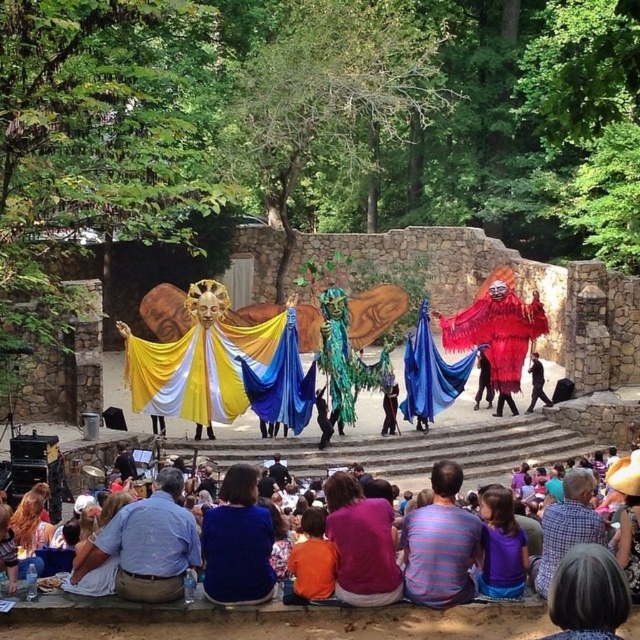
You are an audience member sitting in the front row of the outdoor theatrical performance. You notice two items on the stage. The first is the striped cotton shirt at lower center worn by a performer, and the second is the blue fabric at center. Which item takes up more space on the stage?

The blue fabric at center takes up more space on the stage than the striped cotton shirt at lower center because the striped cotton shirt at lower center occupies less space than blue fabric at center.

You are an audience member sitting at the front row of the outdoor theatrical performance. You notice a striped cotton shirt at lower center. Where exactly is the striped cotton shirt located in relation to your view?

The striped cotton shirt at lower center is located at point 0.850 on the horizontal axis and 0.689 on the vertical axis, meaning it is positioned towards the right and lower part of your field of view.

You are a photographer positioned at the front of the stage. You want to capture a photo that shows both the yellow satin cape at center and the blue cotton shirt at lower center clearly. Which object will appear closer to the camera in the photo?

The yellow satin cape at center will appear closer to the camera because the blue cotton shirt at lower center is behind it.